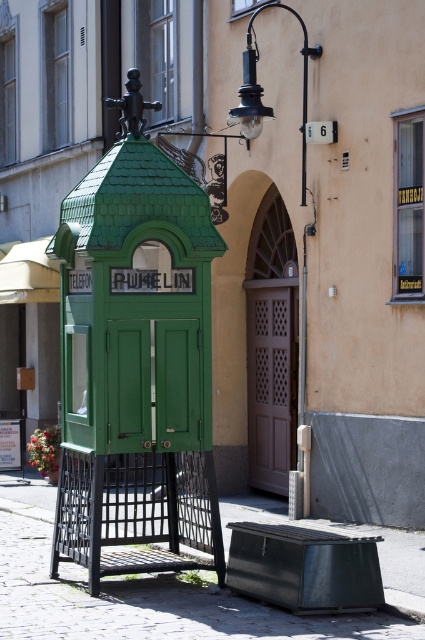
Question: Can you confirm if green metal bench at lower center is thinner than matte black lamp post at upper right?

Choices:
 (A) no
 (B) yes

Answer: (B)

Question: Does green matte telephone booth at center appear over matte black lamp post at upper right?

Choices:
 (A) yes
 (B) no

Answer: (B)

Question: Which point is closer to the camera?

Choices:
 (A) matte black lamp post at upper right
 (B) green metal bench at lower center

Answer: (A)

Question: Estimate the real-world distances between objects in this image. Which object is farther from the matte black lamp post at upper right?

Choices:
 (A) green matte telephone booth at center
 (B) green metal bench at lower center

Answer: (B)

Question: Does green metal bench at lower center come in front of matte black lamp post at upper right?

Choices:
 (A) yes
 (B) no

Answer: (B)

Question: Based on their relative distances, which object is farther from the matte black lamp post at upper right?

Choices:
 (A) green metal bench at lower center
 (B) green matte telephone booth at center

Answer: (A)